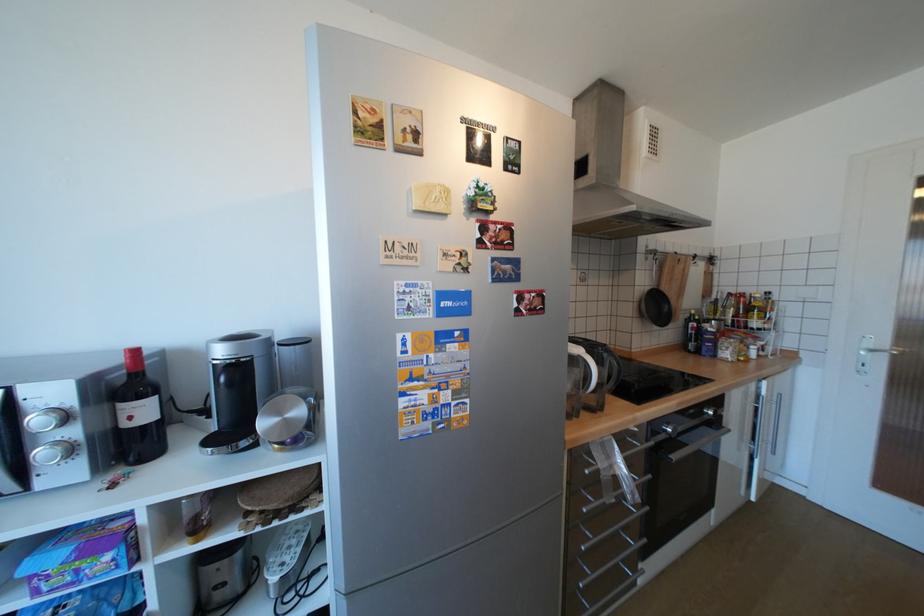
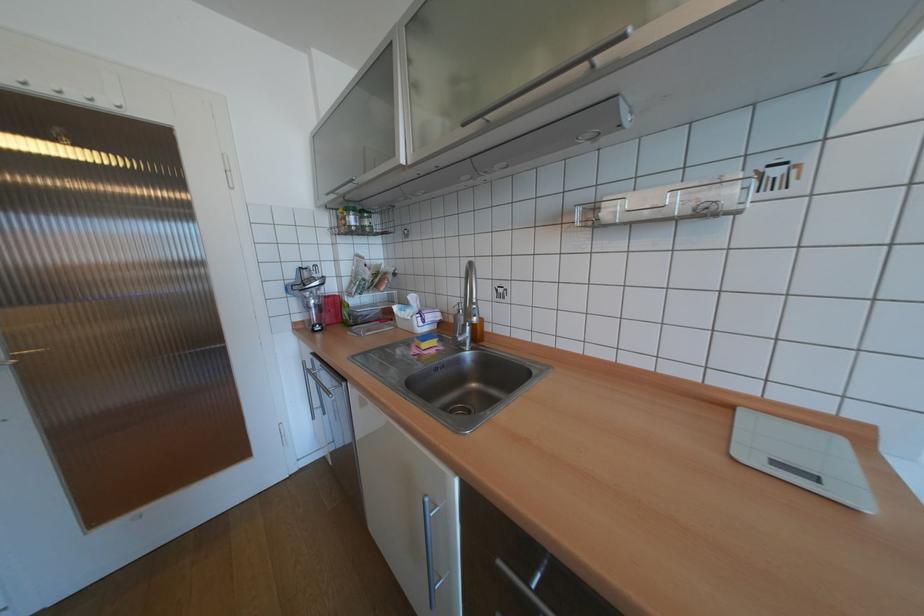
Question: Based on the continuous images, in which direction is the camera rotating? Reply with the corresponding letter.

Choices:
 (A) Left
 (B) Right
 (C) Up
 (D) Down

Answer: (B)